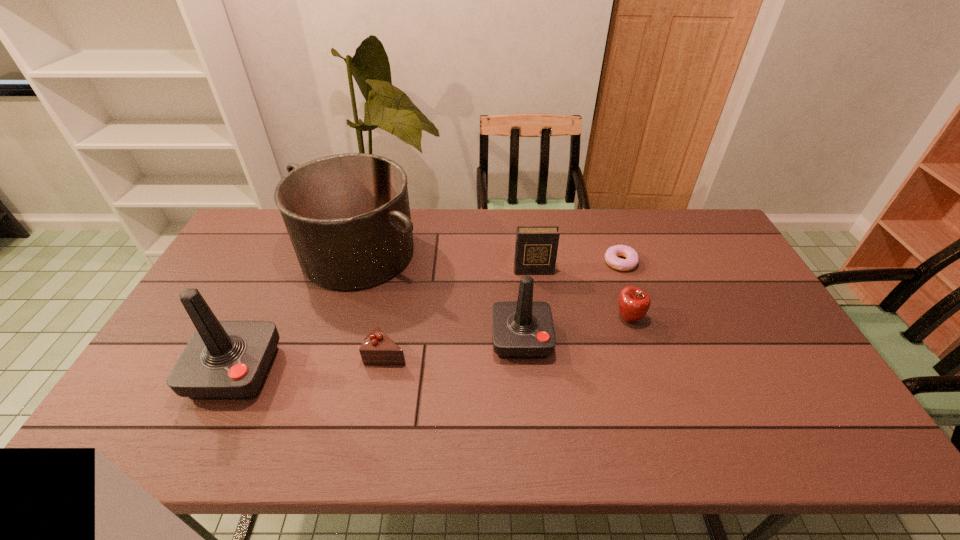
Locate an element on the screen. vacant region located on the left of the pan is located at coordinates (244, 253).

Locate an element on the screen. free space located 0.180m on the front cover of the fourth shortest object is located at coordinates (540, 317).

Find the location of `vacant point located 0.220m on the right of the apple`. vacant point located 0.220m on the right of the apple is located at coordinates (719, 318).

Locate an element on the screen. free space located 0.230m on the left of the doughnut is located at coordinates point(535,262).

At what (x,y) coordinates should I click in order to perform the action: click on free spot located 0.350m on the right of the chocolate cake. Please return your answer as a coordinate pair (x, y). Looking at the image, I should click on (538, 354).

At what (x,y) coordinates should I click in order to perform the action: click on object present at the far edge. Please return your answer as a coordinate pair (x, y). Looking at the image, I should click on (348, 217).

This screenshot has width=960, height=540. In order to click on object at the near edge in this screenshot , I will do `click(224, 360)`.

What are the coordinates of `object at the left edge` in the screenshot? It's located at (224, 360).

The height and width of the screenshot is (540, 960). In order to click on object that is at the near left corner in this screenshot , I will do `click(224, 360)`.

Find the location of a particular element. This screenshot has width=960, height=540. free space at the far edge is located at coordinates pyautogui.click(x=612, y=208).